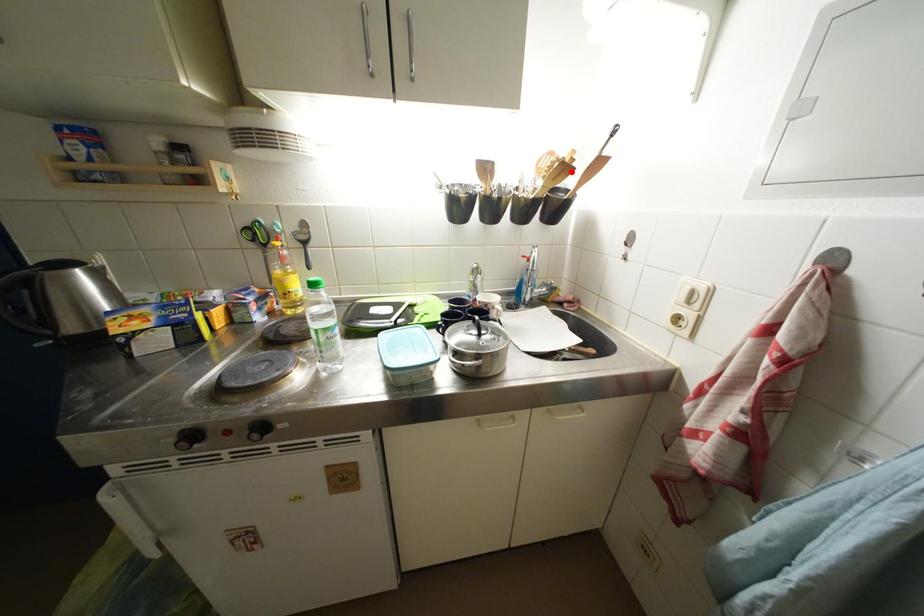
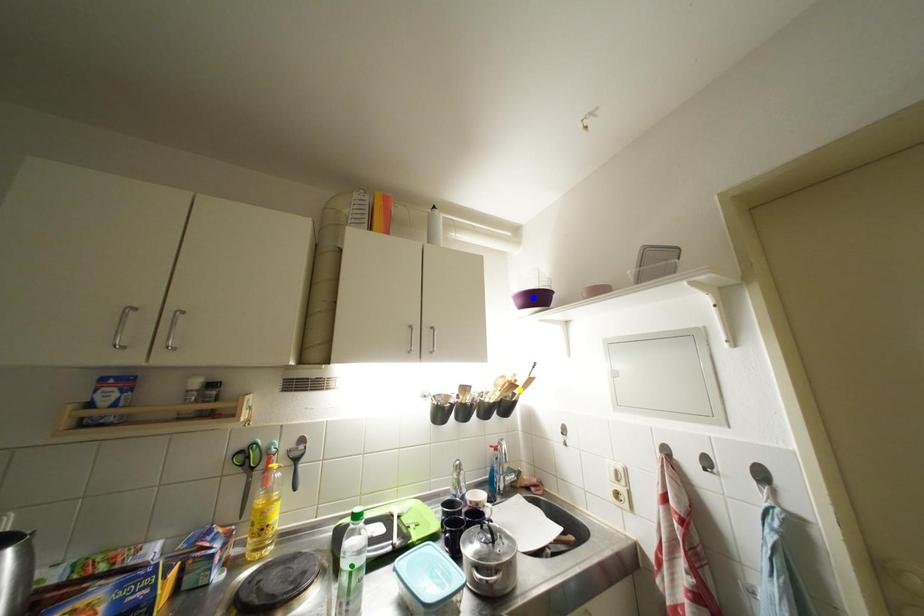
Question: I am providing you with two images of the same scene from different viewpoints. A red point is marked on the first image. You are given multiple points on the second image. Can you choose the point in image 2 that corresponds to the point in image 1?

Choices:
 (A) green point
 (B) blue point
 (C) yellow point

Answer: (C)